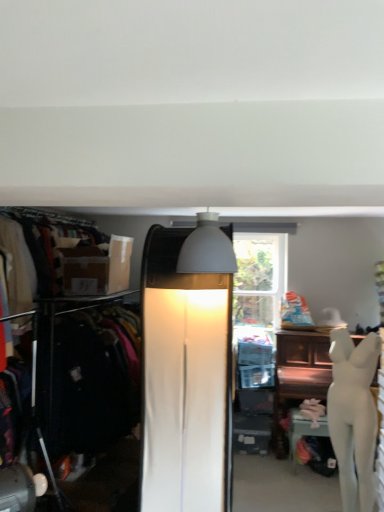
Question: From the image's perspective, is matte black clothing rack at left above or below white matte lampshade at upper center, acting as the first lamp starting from the top?

Choices:
 (A) below
 (B) above

Answer: (A)

Question: Is matte black clothing rack at left taller or shorter than white matte lampshade at upper center, which appears as the 1th lamp when viewed from the front?

Choices:
 (A) tall
 (B) short

Answer: (A)

Question: Considering the real-world distances, which object is closest to the white glossy mannequin at lower right?

Choices:
 (A) matte brown box at left
 (B) matte black clothing rack at left
 (C) matte white lamp at center, the first lamp in the bottom-to-top sequence
 (D) white glossy statue at right
 (E) white matte lampshade at upper center, the second lamp in the back-to-front sequence

Answer: (C)

Question: Estimate the real-world distances between objects in this image. Which object is farther from the white glossy mannequin at lower right?

Choices:
 (A) matte black clothing rack at left
 (B) matte white lamp at center, the second lamp viewed from the top
 (C) white glossy statue at right
 (D) matte brown box at left
 (E) white matte lampshade at upper center, which appears as the 1th lamp when viewed from the front

Answer: (D)